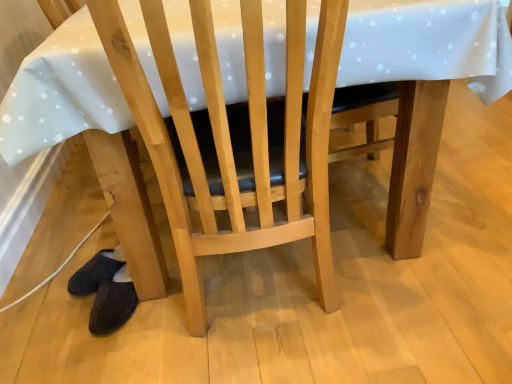
Question: Considering the relative sizes of wooden chair at center and dark blue fuzzy slippers at lower left in the image provided, is wooden chair at center smaller than dark blue fuzzy slippers at lower left?

Choices:
 (A) yes
 (B) no

Answer: (B)

Question: From the image's perspective, is wooden chair at center above dark blue fuzzy slippers at lower left?

Choices:
 (A) yes
 (B) no

Answer: (A)

Question: Is wooden chair at center facing towards dark blue fuzzy slippers at lower left?

Choices:
 (A) yes
 (B) no

Answer: (B)

Question: Is dark blue fuzzy slippers at lower left a part of wooden chair at center?

Choices:
 (A) yes
 (B) no

Answer: (B)

Question: Does wooden chair at center have a greater width compared to dark blue fuzzy slippers at lower left?

Choices:
 (A) yes
 (B) no

Answer: (A)

Question: Considering the relative sizes of wooden chair at center and dark blue fuzzy slippers at lower left in the image provided, is wooden chair at center thinner than dark blue fuzzy slippers at lower left?

Choices:
 (A) no
 (B) yes

Answer: (A)

Question: From the image's perspective, would you say dark blue fuzzy slippers at lower left is positioned over wooden chair at center?

Choices:
 (A) no
 (B) yes

Answer: (A)

Question: From a real-world perspective, is dark blue fuzzy slippers at lower left physically below wooden chair at center?

Choices:
 (A) no
 (B) yes

Answer: (B)

Question: Considering the relative positions of dark blue fuzzy slippers at lower left and wooden chair at center in the image provided, is dark blue fuzzy slippers at lower left to the left of wooden chair at center from the viewer's perspective?

Choices:
 (A) yes
 (B) no

Answer: (A)

Question: Is the surface of dark blue fuzzy slippers at lower left in direct contact with wooden chair at center?

Choices:
 (A) no
 (B) yes

Answer: (A)

Question: From the image's perspective, is dark blue fuzzy slippers at lower left below wooden chair at center?

Choices:
 (A) yes
 (B) no

Answer: (A)

Question: Is dark blue fuzzy slippers at lower left oriented towards wooden chair at center?

Choices:
 (A) no
 (B) yes

Answer: (A)

Question: From a real-world perspective, is wooden chair at center positioned above or below dark blue fuzzy slippers at lower left?

Choices:
 (A) above
 (B) below

Answer: (A)